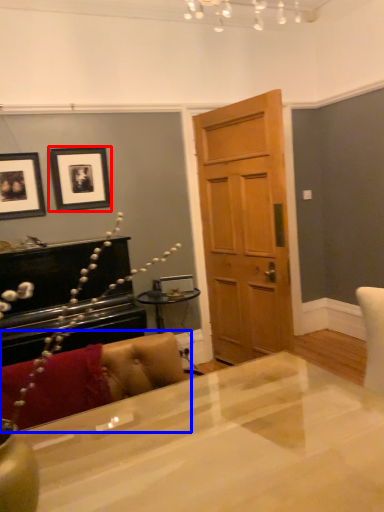
Question: Which of the following is the closest to the observer, picture frame (highlighted by a red box) or couch (highlighted by a blue box)?

Choices:
 (A) picture frame
 (B) couch

Answer: (B)